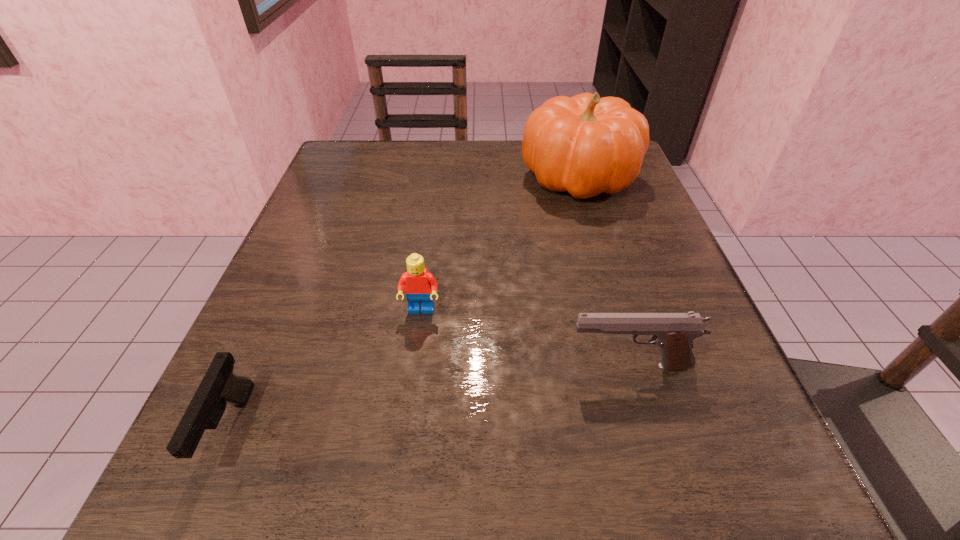
Identify the location of vacant area that lies between the tallest object and the third farthest object. This screenshot has height=540, width=960. (604, 271).

I want to click on vacant space that is in between the second farthest object and the nearer pistol, so click(325, 370).

Find the location of a particular element. free space between the leftmost object and the farthest object is located at coordinates (404, 303).

I want to click on unoccupied position between the right pistol and the pumpkin, so click(604, 271).

Locate an element on the screen. vacant space that's between the second farthest object and the pumpkin is located at coordinates (500, 244).

Find the location of a particular element. vacant space that is in between the second farthest object and the farther pistol is located at coordinates (525, 339).

Where is `vacant point located between the shorter pistol and the right pistol`? vacant point located between the shorter pistol and the right pistol is located at coordinates (430, 398).

This screenshot has height=540, width=960. I want to click on object identified as the third closest to the third farthest object, so click(x=219, y=386).

Locate an element on the screen. The height and width of the screenshot is (540, 960). object that ranks as the second closest to the third nearest object is located at coordinates (219, 386).